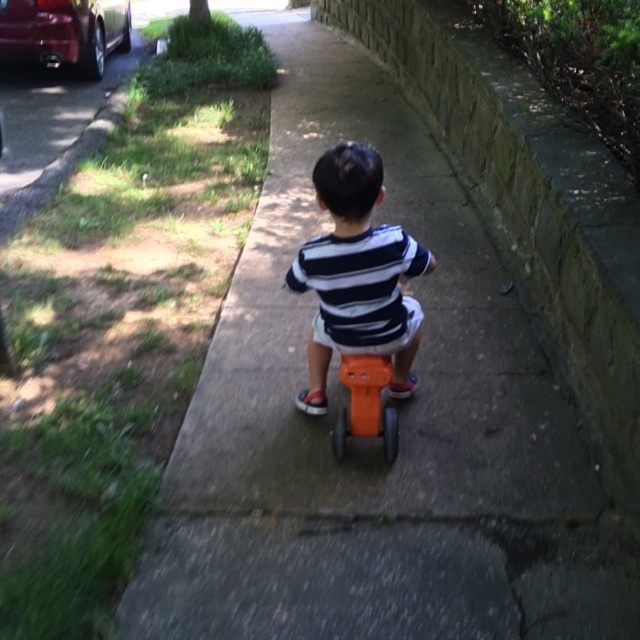
Is metallic red car at upper left smaller than orange plastic toy at center?

Actually, metallic red car at upper left might be larger than orange plastic toy at center.

Locate an element on the screen. The height and width of the screenshot is (640, 640). metallic red car at upper left is located at coordinates (65, 32).

Find the location of a particular element. Image resolution: width=640 pixels, height=640 pixels. metallic red car at upper left is located at coordinates (65, 32).

Locate an element on the screen. The height and width of the screenshot is (640, 640). matte orange plastic tricycle at center is located at coordinates (356, 275).

Which is more to the left, matte orange plastic tricycle at center or metallic red car at upper left?

Positioned to the left is metallic red car at upper left.

The image size is (640, 640). I want to click on matte orange plastic tricycle at center, so click(x=356, y=275).

Measure the distance between matte orange plastic tricycle at center and orange plastic toy at center.

A distance of 6.39 inches exists between matte orange plastic tricycle at center and orange plastic toy at center.

Is the position of matte orange plastic tricycle at center less distant than that of orange plastic toy at center?

Yes, it is in front of orange plastic toy at center.

Is point (388, 275) less distant than point (380, 365)?

Yes, it is.

Locate an element on the screen. matte orange plastic tricycle at center is located at coordinates (356, 275).